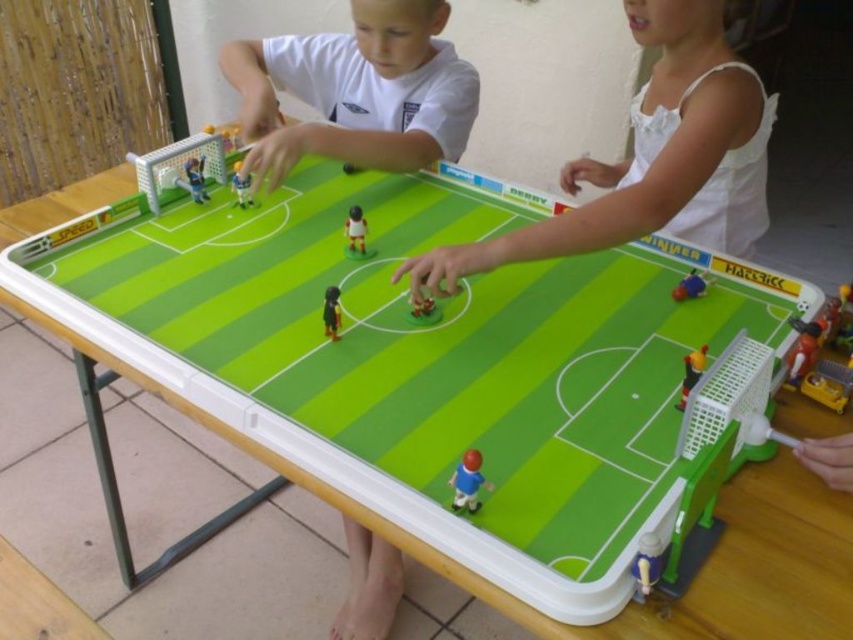
Which is in front, point (653, 536) or point (683, 356)?

Point (653, 536) is more forward.

Does smooth plastic toy at lower right appear on the right side of shiny red plastic figure at center?

No, smooth plastic toy at lower right is not to the right of shiny red plastic figure at center.

Does point (631, 563) come behind point (700, 362)?

No, it is not.

I want to click on smooth plastic toy at lower right, so pyautogui.click(x=646, y=564).

Does shiny metallic figure at center appear over shiny red plastic figure at center?

Yes.

Does shiny metallic figure at center have a larger size compared to shiny red plastic figure at center?

Indeed, shiny metallic figure at center has a larger size compared to shiny red plastic figure at center.

Is point (799, 353) farther from viewer compared to point (688, 380)?

Yes, it is behind point (688, 380).

Identify the location of shiny metallic figure at center. (804, 348).

Does white plastic figure at center have a lesser width compared to shiny plastic soccer ball at center?

In fact, white plastic figure at center might be wider than shiny plastic soccer ball at center.

Between white plastic figure at center and shiny plastic soccer ball at center, which one has less height?

With less height is shiny plastic soccer ball at center.

Is point (352, 205) behind point (415, 307)?

Yes, point (352, 205) is farther from viewer.

At what (x,y) coordinates should I click in order to perform the action: click on white plastic figure at center. Please return your answer as a coordinate pair (x, y). Looking at the image, I should click on (355, 230).